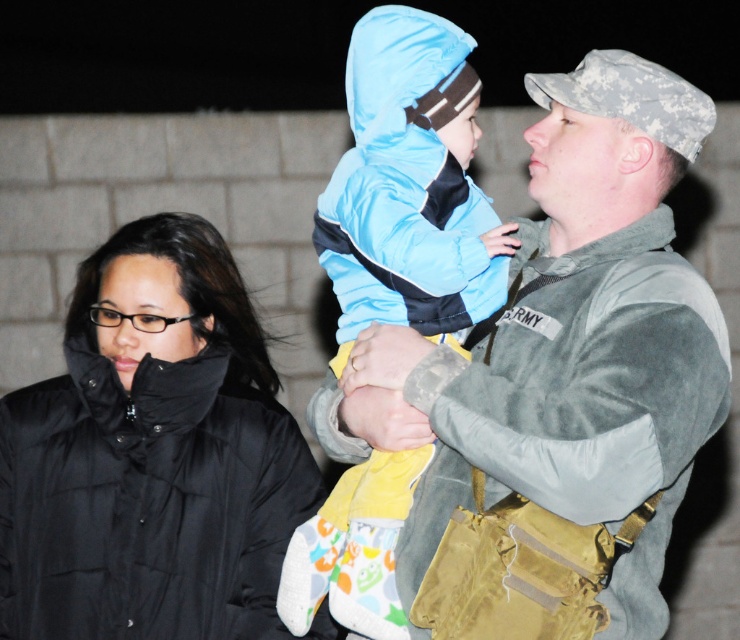
Question: Can you confirm if camouflage fabric jacket at center is wider than black puffer jacket at left?

Choices:
 (A) yes
 (B) no

Answer: (B)

Question: Which object appears farthest from the camera in this image?

Choices:
 (A) camouflage fabric jacket at center
 (B) black puffer jacket at left

Answer: (B)

Question: Does camouflage fabric jacket at center have a lesser width compared to black puffer jacket at left?

Choices:
 (A) yes
 (B) no

Answer: (A)

Question: Observing the image, what is the correct spatial positioning of camouflage fabric jacket at center in reference to black puffer jacket at left?

Choices:
 (A) left
 (B) right

Answer: (B)